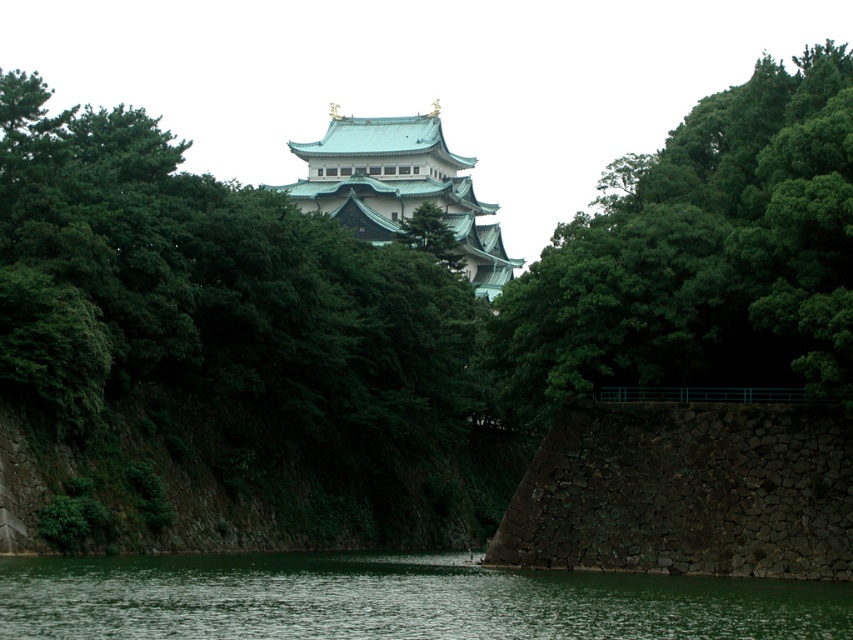
Does green stone river at lower center have a larger size compared to teal glazed tower at center?

Incorrect, green stone river at lower center is not larger than teal glazed tower at center.

Can you confirm if green stone river at lower center is taller than teal glazed tower at center?

In fact, green stone river at lower center may be shorter than teal glazed tower at center.

Where is `green stone river at lower center`? green stone river at lower center is located at coordinates [395, 600].

The height and width of the screenshot is (640, 853). Find the location of `green stone river at lower center`. green stone river at lower center is located at coordinates (395, 600).

Does green leafy tree at upper center have a larger size compared to green stone river at lower center?

Yes.

Which of these two, green leafy tree at upper center or green stone river at lower center, stands taller?

green leafy tree at upper center

What do you see at coordinates (701, 253) in the screenshot?
I see `green leafy tree at upper center` at bounding box center [701, 253].

The image size is (853, 640). In order to click on green leafy tree at upper center in this screenshot , I will do `click(701, 253)`.

Is green leafy tree at upper center shorter than teal glazed tower at center?

Incorrect, green leafy tree at upper center's height does not fall short of teal glazed tower at center's.

Who is more forward, (694, 260) or (410, 134)?

Point (694, 260)

What do you see at coordinates (701, 253) in the screenshot? I see `green leafy tree at upper center` at bounding box center [701, 253].

What are the coordinates of `green leafy tree at upper center` in the screenshot? It's located at (701, 253).